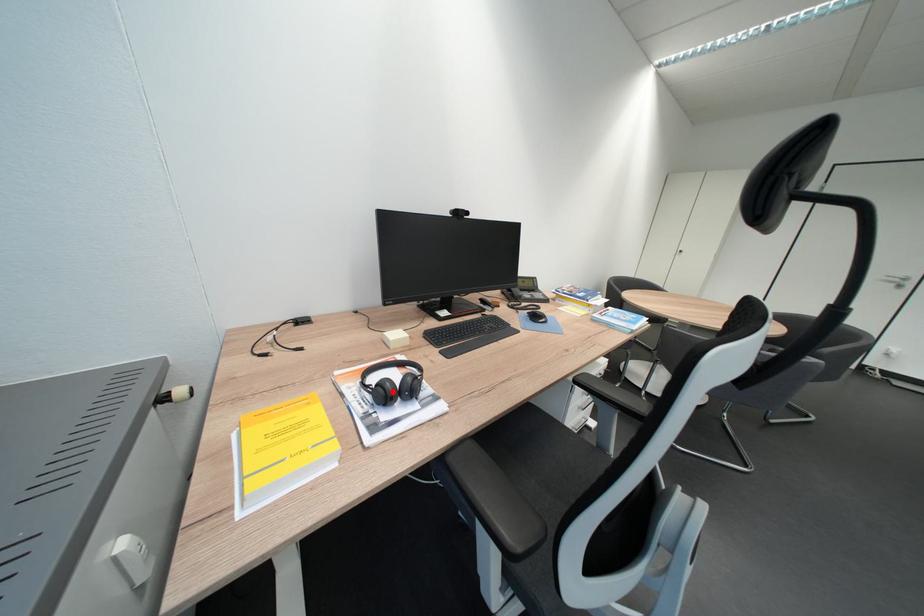
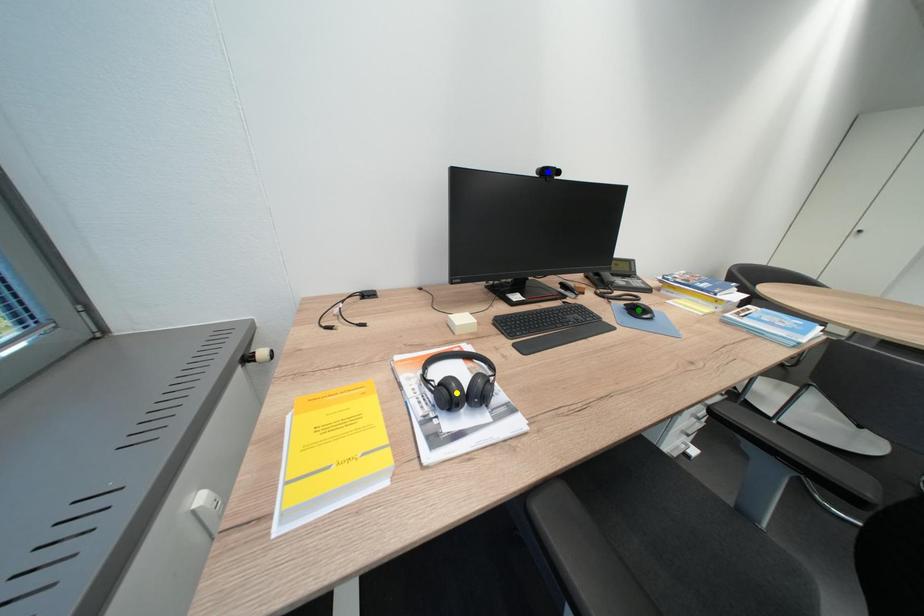
Question: I am providing you with two images of the same scene from different viewpoints. A red point is marked on the first image. You are given multiple points on the second image. Which mark in image 2 goes with the point in image 1?

Choices:
 (A) blue point
 (B) yellow point
 (C) green point

Answer: (B)